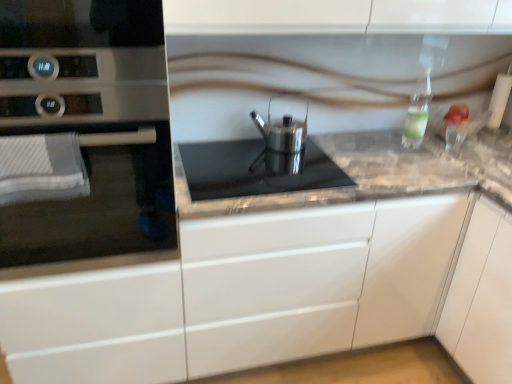
Find the location of a particular element. vacant area that is in front of clear glass bottle at upper right is located at coordinates (423, 163).